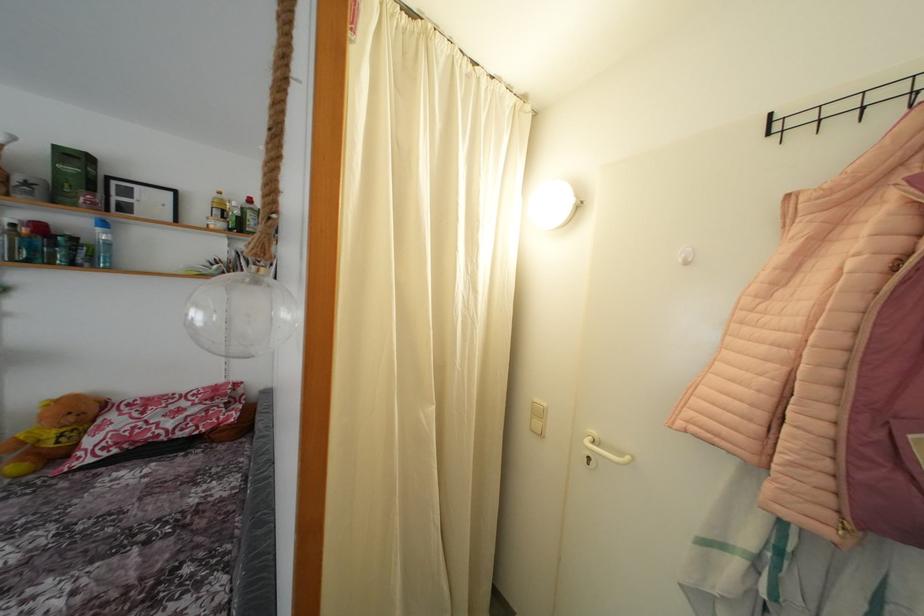
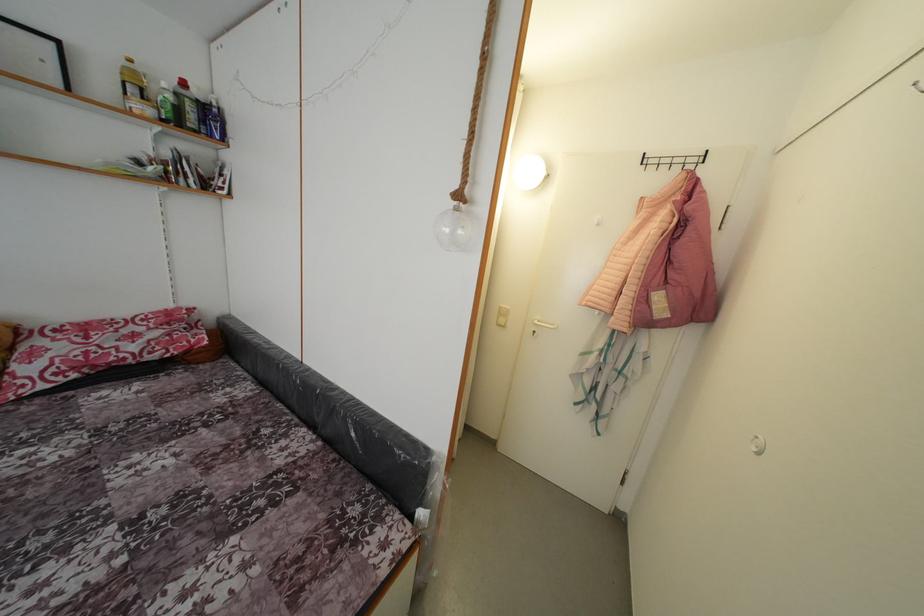
Question: How did the camera likely rotate?

Choices:
 (A) Left
 (B) Right
 (C) Up
 (D) Down

Answer: (B)